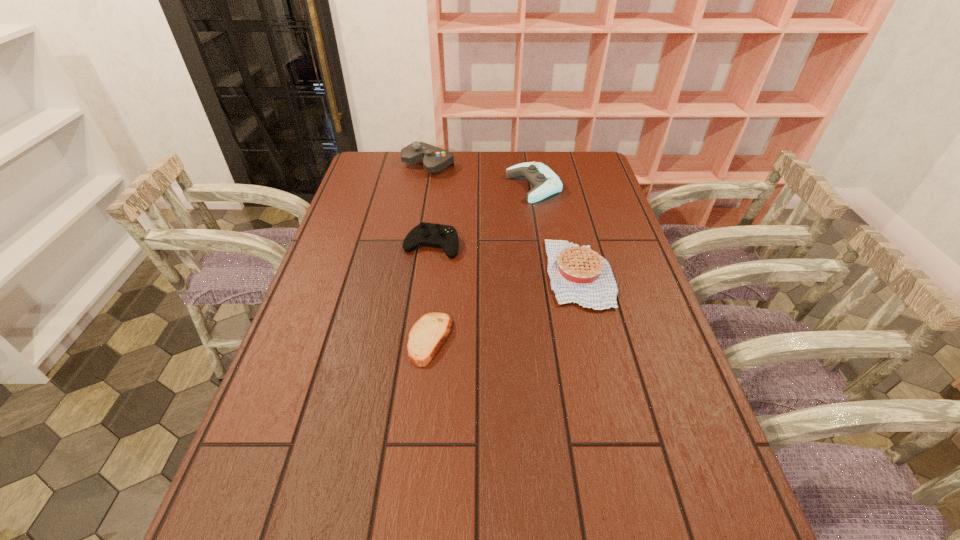
Image resolution: width=960 pixels, height=540 pixels. I want to click on unoccupied position between the rightmost control and the shortest object, so click(x=482, y=263).

The image size is (960, 540). I want to click on unoccupied area between the tallest control and the nearest control, so click(430, 205).

Find the location of a particular element. The width and height of the screenshot is (960, 540). vacant space that is in between the tallest control and the rightmost control is located at coordinates (481, 176).

The image size is (960, 540). Find the location of `free point between the rightmost control and the tallest control`. free point between the rightmost control and the tallest control is located at coordinates (481, 176).

The width and height of the screenshot is (960, 540). I want to click on free space between the tallest control and the shortest object, so click(x=429, y=252).

The image size is (960, 540). Find the location of `vacant area between the pie and the rightmost control`. vacant area between the pie and the rightmost control is located at coordinates (557, 231).

Locate an element on the screen. free spot between the rightmost control and the tallest control is located at coordinates (481, 176).

Locate an element on the screen. vacant area between the nearest control and the rightmost control is located at coordinates (483, 216).

Image resolution: width=960 pixels, height=540 pixels. I want to click on the third closest object to the nearest control, so click(x=580, y=275).

Identify the location of object that stands as the second closest to the pita bread. This screenshot has width=960, height=540. (580, 275).